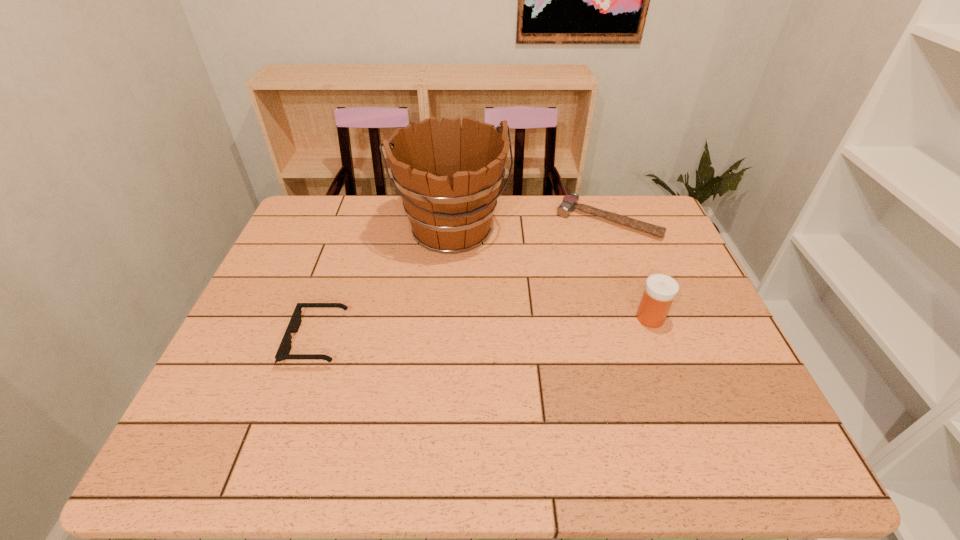
Locate an element on the screen. object that is at the far right corner is located at coordinates (569, 203).

You are a GUI agent. You are given a task and a screenshot of the screen. Output one action in this format:
    pyautogui.click(x=<x>, y=<y>)
    Task: Click on the vacant area at the far edge of the desktop
    Image resolution: width=960 pixels, height=540 pixels.
    Given the screenshot: What is the action you would take?
    pyautogui.click(x=515, y=202)

Image resolution: width=960 pixels, height=540 pixels. In the image, there is a desktop. In order to click on blank space at the near edge in this screenshot , I will do `click(498, 403)`.

You are a GUI agent. You are given a task and a screenshot of the screen. Output one action in this format:
    pyautogui.click(x=<x>, y=<y>)
    Task: Click on the free spot at the left edge of the desktop
    
    Given the screenshot: What is the action you would take?
    pyautogui.click(x=258, y=328)

Locate an element on the screen. vacant space at the right edge of the desktop is located at coordinates pos(690,355).

Locate an element on the screen. vacant space at the far left corner of the desktop is located at coordinates (338, 225).

You are a GUI agent. You are given a task and a screenshot of the screen. Output one action in this format:
    pyautogui.click(x=<x>, y=<y>)
    Task: Click on the free location at the near left corner
    This screenshot has width=960, height=540.
    Given the screenshot: What is the action you would take?
    pyautogui.click(x=244, y=384)

Where is `free space at the far right corner of the desktop`? The image size is (960, 540). free space at the far right corner of the desktop is located at coordinates (619, 207).

Find the location of a particular element. The image size is (960, 540). vacant space at the near right corner of the desktop is located at coordinates (767, 417).

Locate an element on the screen. The width and height of the screenshot is (960, 540). vacant area between the hammer and the leftmost object is located at coordinates click(462, 280).